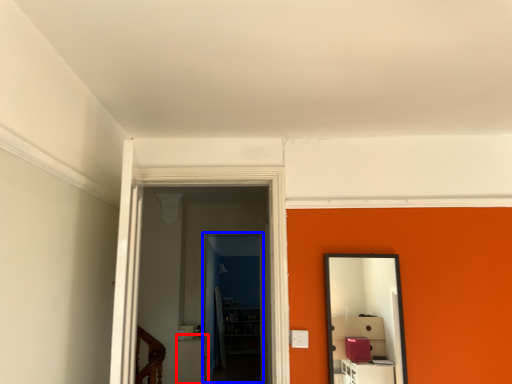
Question: Which object is closer to the camera taking this photo, furniture (highlighted by a red box) or glass door (highlighted by a blue box)?

Choices:
 (A) furniture
 (B) glass door

Answer: (A)